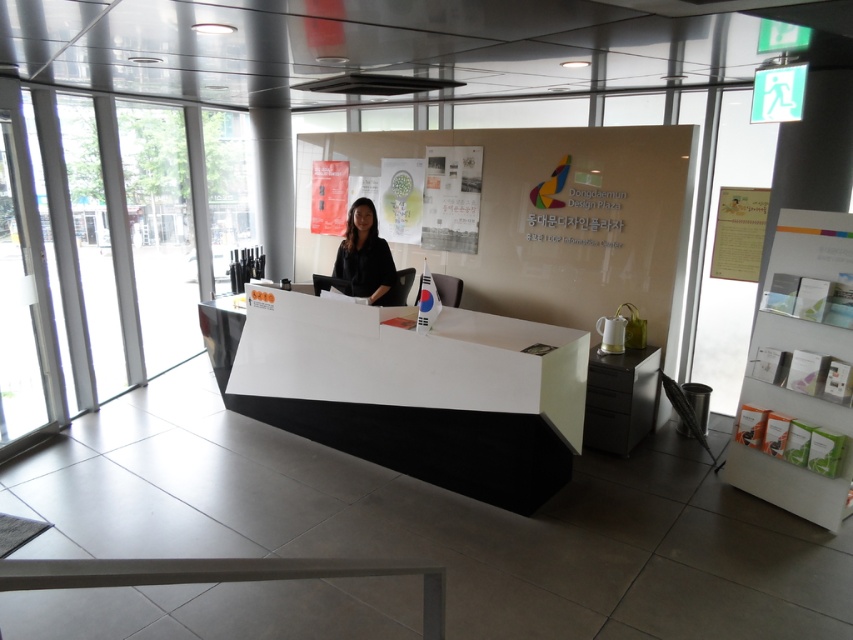
You are standing in the office and need to place a new plant on the desk. The plant requires a spot that is not directly under the window. Given the layout, can you confirm if the white glossy reception desk at center has space to the left of the black matte shirt at center for the plant?

The white glossy reception desk at center is to the right of the black matte shirt at center, so there is space to the left of the black matte shirt at center on the desk where the plant can be placed away from the window.

You are a visitor entering the office and need to place your black matte shirt at center on the white glossy reception desk at center. Is there enough space to place it there?

The white glossy reception desk at center is positioned under the black matte shirt at center, so placing the black matte shirt at center on the desk may not be possible due to their spatial relationship.

You are standing at the entrance of the office and want to walk towards the desk. There are two points marked as point (392,451) and point (341,266). Which point is closer to you?

Point (392,451) is in front of point (341,266), so the point closer to you is point (392,451).